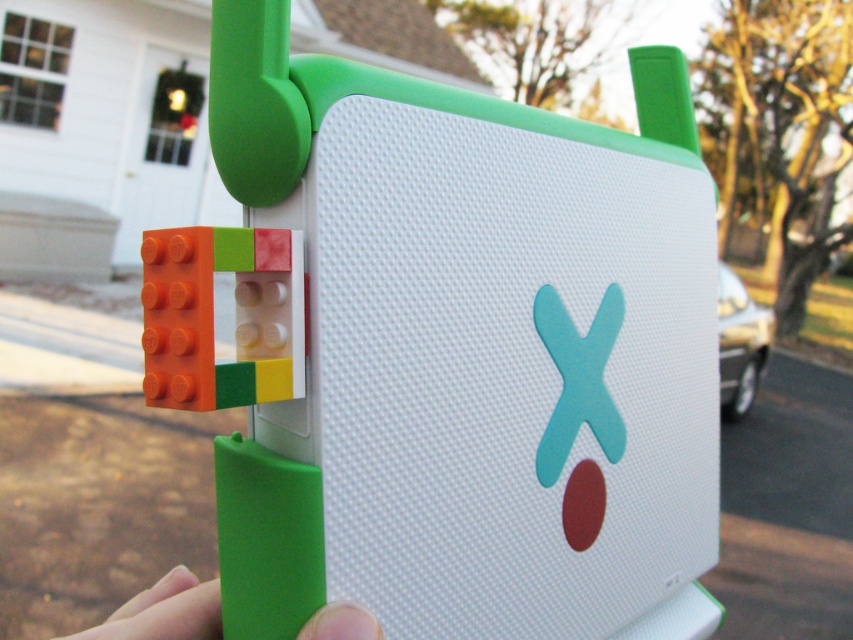
Question: Which of the following is the farthest from the observer?

Choices:
 (A) matte plastic building blocks at left
 (B) green rubber grip at lower center

Answer: (B)

Question: Is matte plastic building blocks at left to the right of green rubber grip at lower center from the viewer's perspective?

Choices:
 (A) no
 (B) yes

Answer: (B)

Question: Does matte plastic building blocks at left have a smaller size compared to green rubber grip at lower center?

Choices:
 (A) no
 (B) yes

Answer: (A)

Question: Which object is closer to the camera taking this photo?

Choices:
 (A) green rubber grip at lower center
 (B) matte plastic building blocks at left

Answer: (B)

Question: Among these objects, which one is farthest from the camera?

Choices:
 (A) matte plastic building blocks at left
 (B) green rubber grip at lower center

Answer: (B)

Question: Where is matte plastic building blocks at left located in relation to green rubber grip at lower center in the image?

Choices:
 (A) below
 (B) above

Answer: (B)